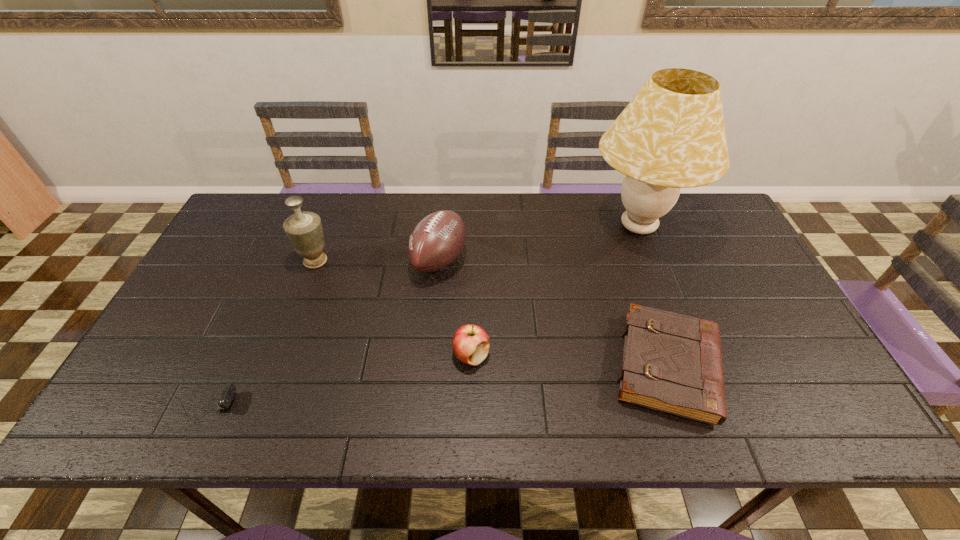
You are a GUI agent. You are given a task and a screenshot of the screen. Output one action in this format:
    pyautogui.click(x=<x>, y=<y>)
    Task: Click on the vacant area that lies between the tallest object and the second shortest object
    
    Given the screenshot: What is the action you would take?
    pyautogui.click(x=653, y=296)

Locate an element on the screen. The height and width of the screenshot is (540, 960). vacant space that's between the fourth shortest object and the shortest object is located at coordinates (318, 332).

Find the location of `vacant space in between the shortest object and the hardback book`. vacant space in between the shortest object and the hardback book is located at coordinates (432, 386).

The image size is (960, 540). Find the location of `empty location between the second shortest object and the third shortest object`. empty location between the second shortest object and the third shortest object is located at coordinates (569, 361).

I want to click on free spot between the lampshade and the second object from left to right, so click(x=477, y=244).

Locate an element on the screen. empty space between the third shortest object and the football (American) is located at coordinates (455, 308).

Identify the location of unoccupied position between the fourth shortest object and the tallest object. (539, 244).

Locate an element on the screen. the fifth closest object to the fourth shortest object is located at coordinates (229, 390).

Identify which object is the fourth nearest to the apple. Please provide its 2D coordinates. Your answer should be formatted as a tuple, i.e. [(x, y)], where the tuple contains the x and y coordinates of a point satisfying the conditions above.

[(304, 230)]

You are a GUI agent. You are given a task and a screenshot of the screen. Output one action in this format:
    pyautogui.click(x=<x>, y=<y>)
    Task: Click on the vacant space that satisfies the following two spatial constraints: 1. on the front side of the third shortest object; 2. on the front-facing side of the shortest object
    The width and height of the screenshot is (960, 540).
    Given the screenshot: What is the action you would take?
    pyautogui.click(x=470, y=405)